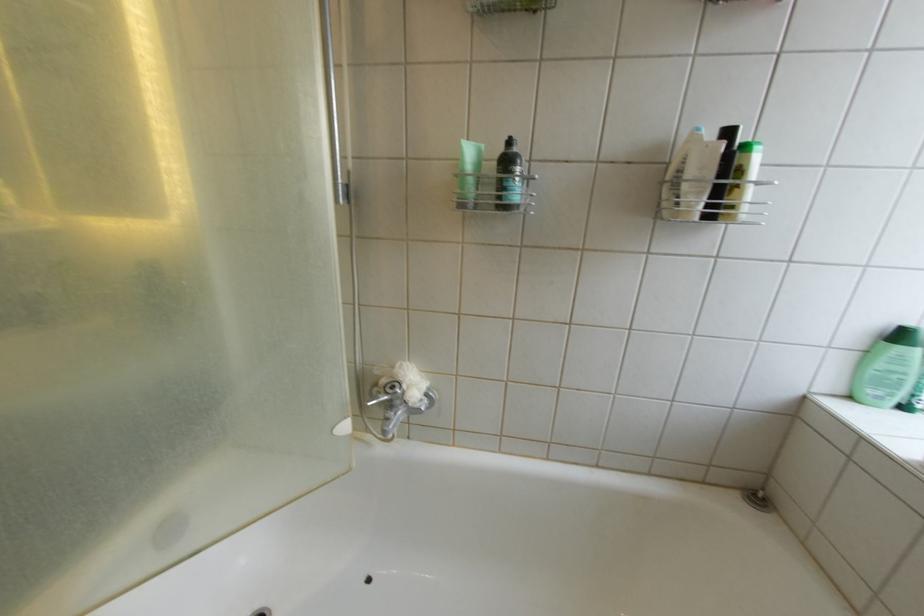
The height and width of the screenshot is (616, 924). What are the coordinates of `shower diverter knob` in the screenshot? It's located at (391, 387).